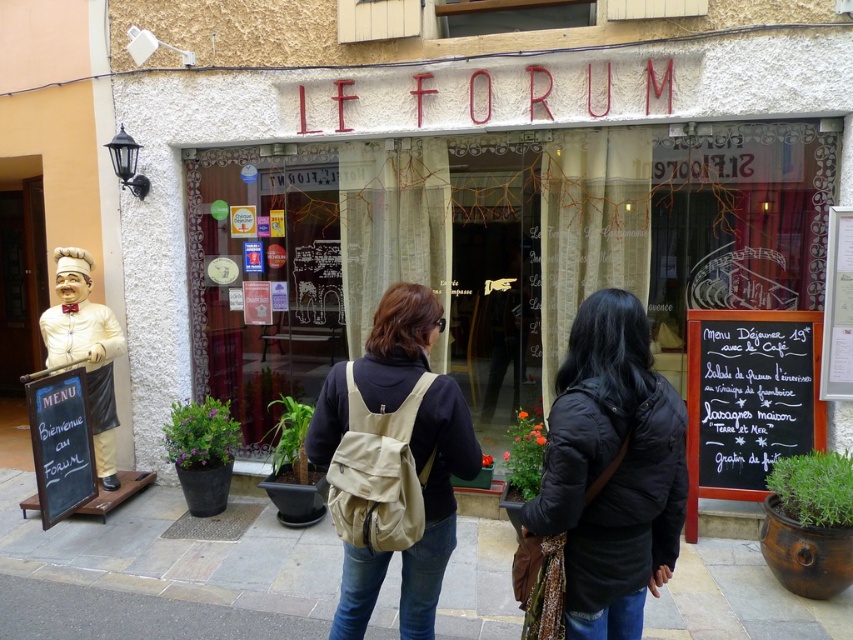
You are a delivery person with a 9 feet wide box. You need to park your truck between the translucent glass shop window at center and the black chalkboard menu at right. Can you fit the truck between them?

The distance between the translucent glass shop window at center and the black chalkboard menu at right is 8.95 feet. Since the box is 9 feet wide, it is slightly wider than the available space, so the truck cannot fit between them.

You are a customer entering the cafe and see both the black matte jacket at center and the beige fabric backpack at center. Which item is narrower?

The black matte jacket at center is narrower than the beige fabric backpack at center.

You are standing in front of the Le Forum cafe and want to take a photo of both the entrance and the chef statue. The entrance is at point (520, 275) and the chef statue is at point (788, 364). Since you want both to be in focus, which point should you focus on first?

You should focus on point (520, 275) first because it is closer to the camera than point (788, 364). This way, adjusting the focus from the closer point to the farther one ensures both are in focus.